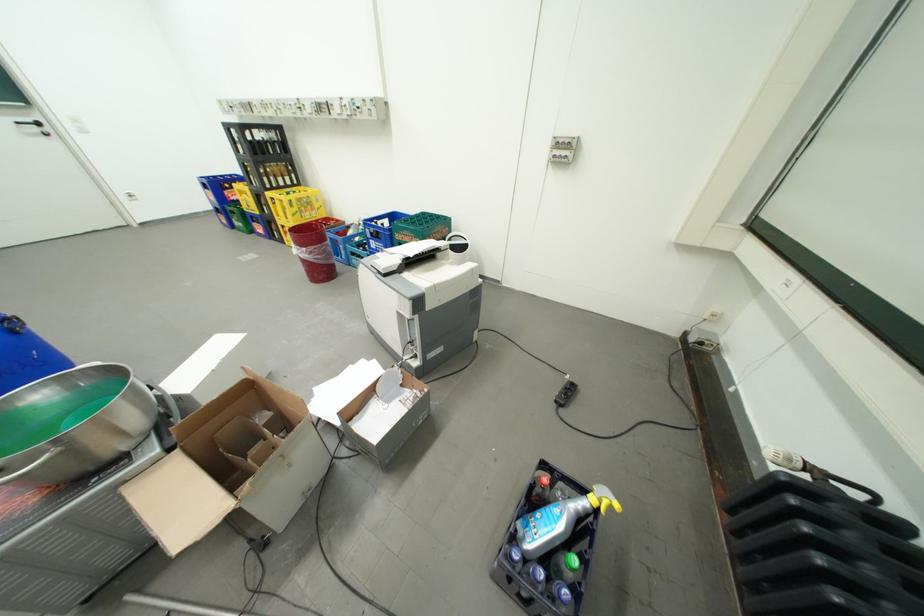
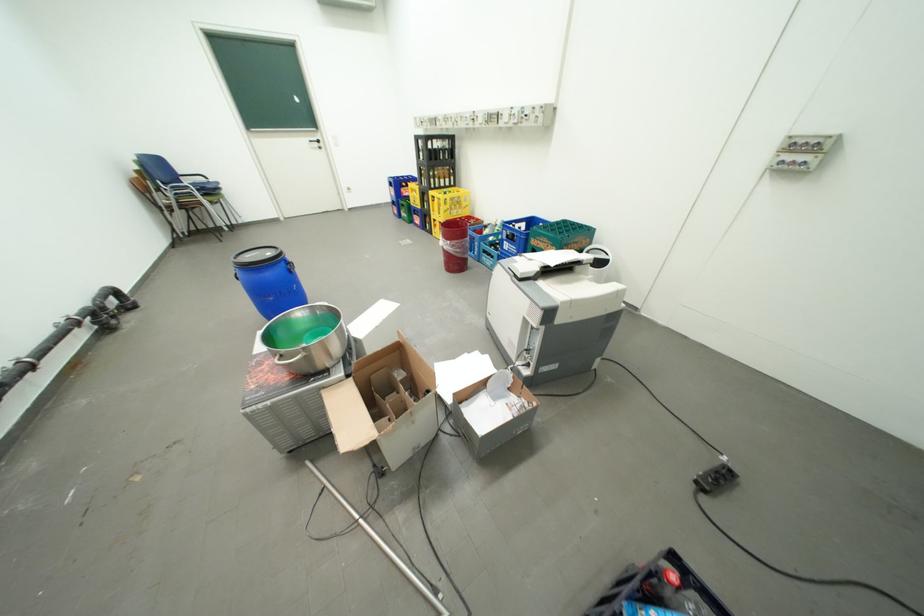
The point at (x=424, y=238) is marked in the first image. Where is the corresponding point in the second image?

(562, 246)